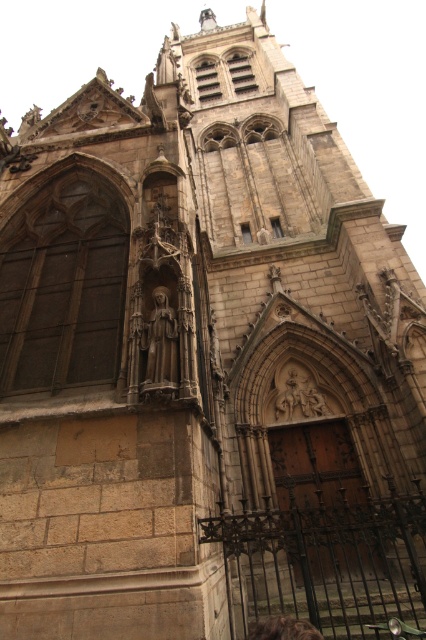
You are standing in front of the Gothic church and notice a smooth stone statue at center and a brown leather bag at lower center. From your vantage point, which object is closer to you?

The smooth stone statue at center is closer to you than the brown leather bag at lower center, which is positioned behind it.

You are standing in front of the Gothic church and notice a smooth stone statue at center and a brown leather bag at lower center. Which object is positioned to the left when viewed from your perspective?

The smooth stone statue at center is to the left of the brown leather bag at lower center.

From the picture: You are an architect examining the church facade. You notice two points marked on the image at coordinates point (146,332) and point (264,627). Which point is closer to the viewer?

Point (264,627) is closer to the viewer because the description states that point (146,332) is behind it.